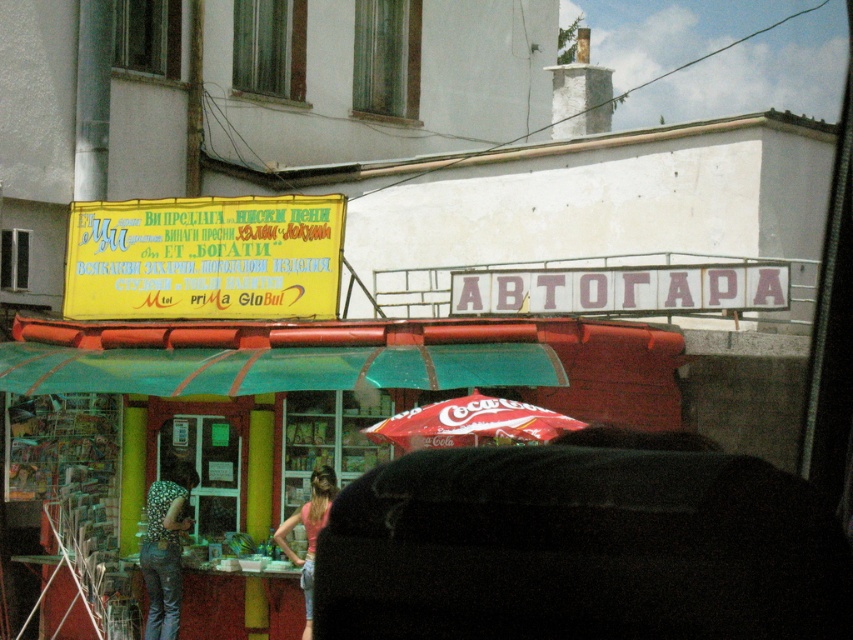
Which is more to the right, yellow matte signboard at upper left or pink fabric at center?

pink fabric at center

Is yellow matte signboard at upper left closer to camera compared to pink fabric at center?

No, yellow matte signboard at upper left is further to the viewer.

Who is more forward, (235,300) or (299,515)?

Positioned in front is point (299,515).

You are a GUI agent. You are given a task and a screenshot of the screen. Output one action in this format:
    pyautogui.click(x=<x>, y=<y>)
    Task: Click on the yellow matte signboard at upper left
    This screenshot has width=853, height=640.
    Given the screenshot: What is the action you would take?
    pyautogui.click(x=204, y=257)

Which is in front, point (250, 216) or point (410, 422)?

Positioned in front is point (410, 422).

Which is more to the left, yellow matte signboard at upper left or red fabric umbrella at center?

yellow matte signboard at upper left

Who is more forward, (x=219, y=257) or (x=486, y=420)?

Positioned in front is point (x=486, y=420).

Find the location of a particular element. This screenshot has height=640, width=853. yellow matte signboard at upper left is located at coordinates (204, 257).

Describe the element at coordinates (471, 422) in the screenshot. The height and width of the screenshot is (640, 853). I see `red fabric umbrella at center` at that location.

Locate an element on the screen. This screenshot has height=640, width=853. red fabric umbrella at center is located at coordinates (471, 422).

Is point (425, 426) farther from camera compared to point (177, 522)?

No.

Locate an element on the screen. Image resolution: width=853 pixels, height=640 pixels. red fabric umbrella at center is located at coordinates (471, 422).